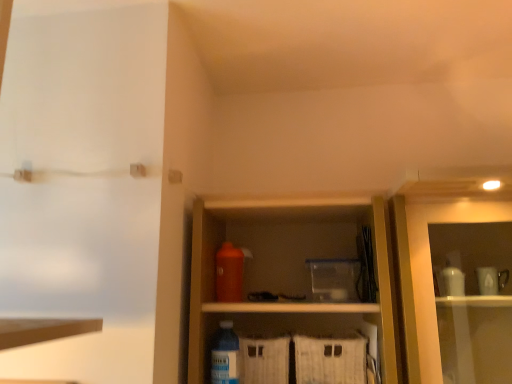
Question: In terms of width, does transparent plastic screen door at upper left look wider or thinner when compared to translucent plastic bottle at lower center, which ranks as the 1th bottle in bottom-to-top order?

Choices:
 (A) wide
 (B) thin

Answer: (A)

Question: In terms of height, does transparent plastic screen door at upper left look taller or shorter compared to translucent plastic bottle at lower center, which ranks as the 1th bottle in bottom-to-top order?

Choices:
 (A) short
 (B) tall

Answer: (B)

Question: Which is farther from the orange matte bottle at center, the 1th bottle positioned from the back?

Choices:
 (A) translucent plastic bottle at lower center, which ranks as the 1th bottle in bottom-to-top order
 (B) transparent plastic screen door at upper left

Answer: (B)

Question: Which object is positioned farthest from the translucent plastic bottle at lower center, the 2th bottle from the top?

Choices:
 (A) transparent plastic screen door at upper left
 (B) orange matte bottle at center, the 1th bottle when ordered from top to bottom

Answer: (A)